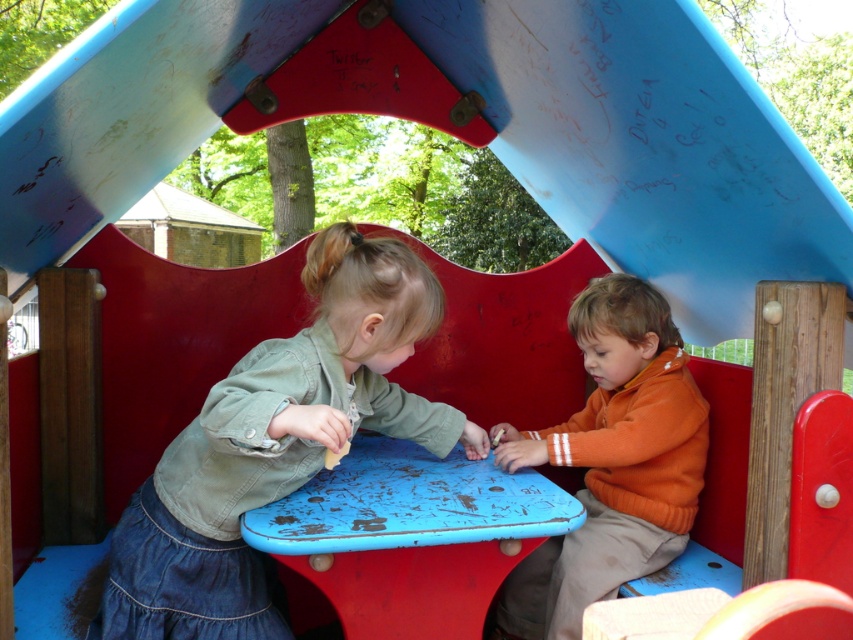
Can you confirm if denim jacket at left is thinner than orange fleece sweater at center?

No.

Who is positioned more to the right, denim jacket at left or orange fleece sweater at center?

orange fleece sweater at center

Measure the distance between denim jacket at left and camera.

denim jacket at left and camera are 4.55 feet apart from each other.

This screenshot has height=640, width=853. Find the location of `denim jacket at left`. denim jacket at left is located at coordinates (276, 445).